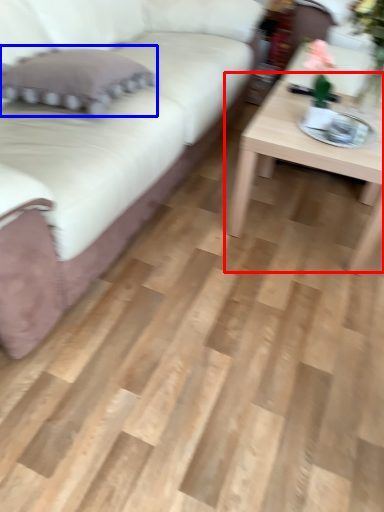
Question: Which of the following is the closest to the observer, coffee table (highlighted by a red box) or pillow (highlighted by a blue box)?

Choices:
 (A) coffee table
 (B) pillow

Answer: (B)